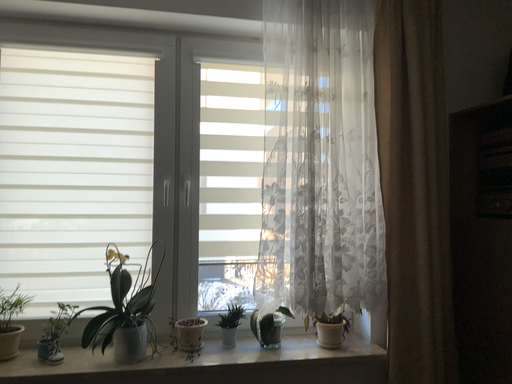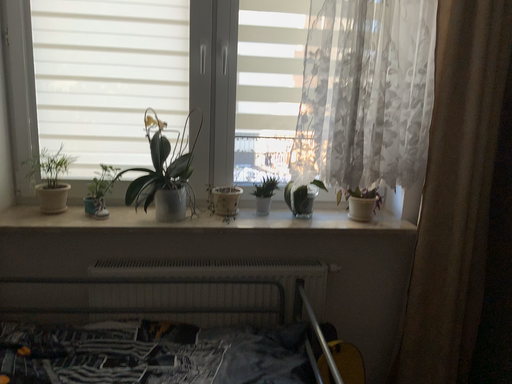
Question: Which way did the camera rotate in the video?

Choices:
 (A) rotated downward
 (B) rotated upward

Answer: (A)